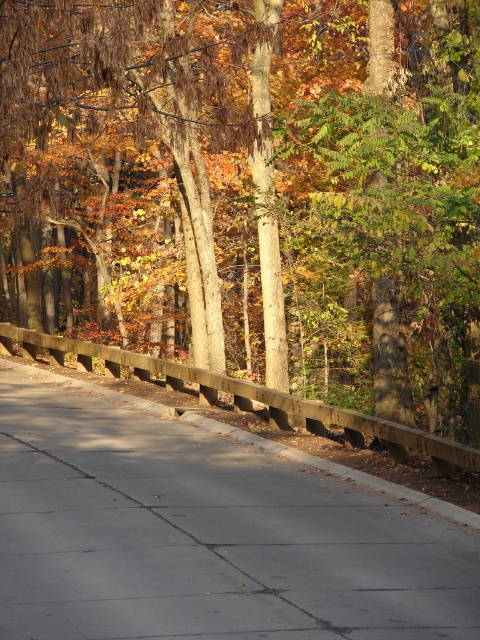
Question: Can you confirm if brown wooden fence at center is positioned to the left of concrete at center?

Choices:
 (A) yes
 (B) no

Answer: (A)

Question: Which of the following is the farthest from the observer?

Choices:
 (A) (430, 556)
 (B) (399, 300)

Answer: (B)

Question: Does brown wooden fence at center come in front of concrete at center?

Choices:
 (A) yes
 (B) no

Answer: (B)

Question: Can you confirm if brown wooden fence at center is positioned below concrete at center?

Choices:
 (A) no
 (B) yes

Answer: (A)